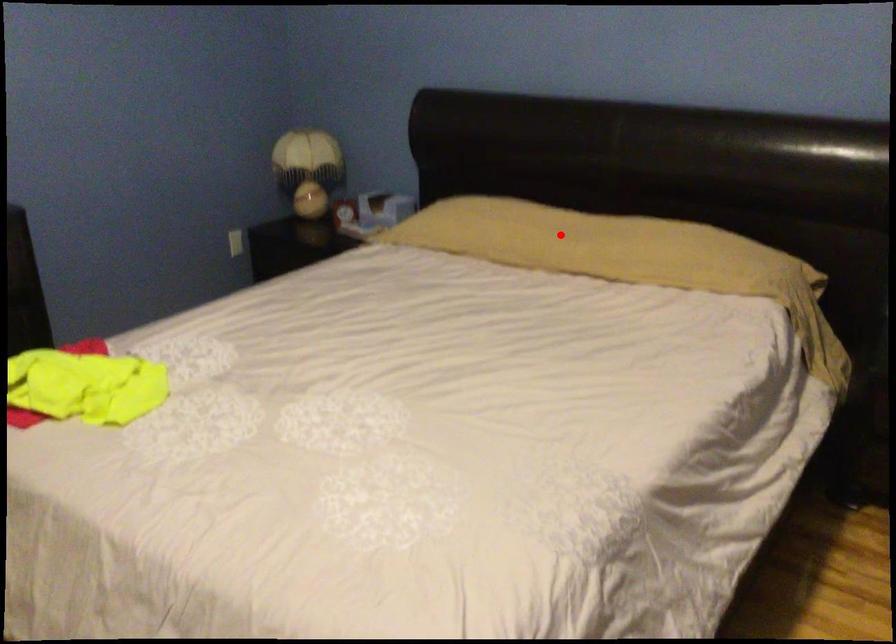
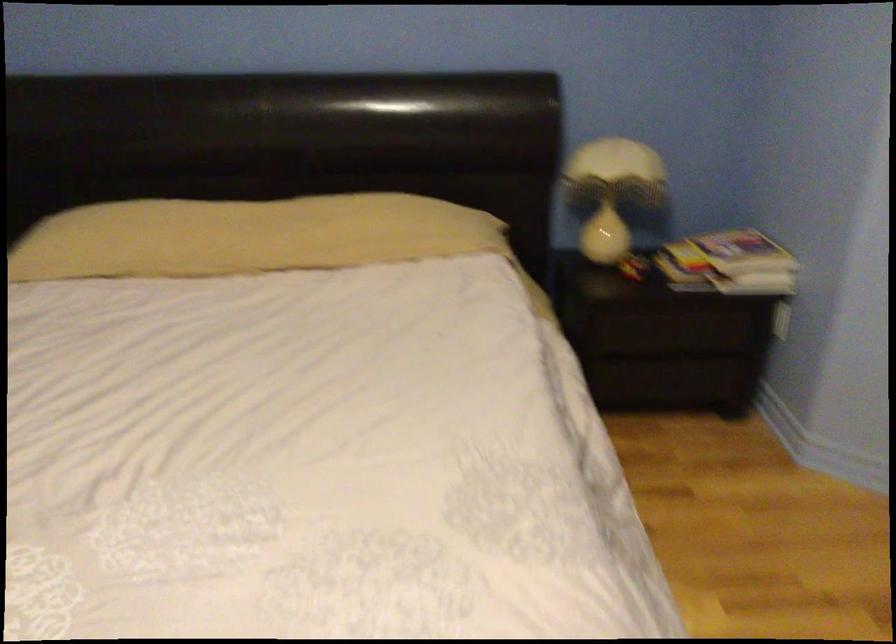
Question: I am providing you with two images of the same scene from different viewpoints. Given a red point in image1, look at the same physical point in image2. Is it:

Choices:
 (A) Closer to the viewpoint
 (B) Farther from the viewpoint

Answer: (A)